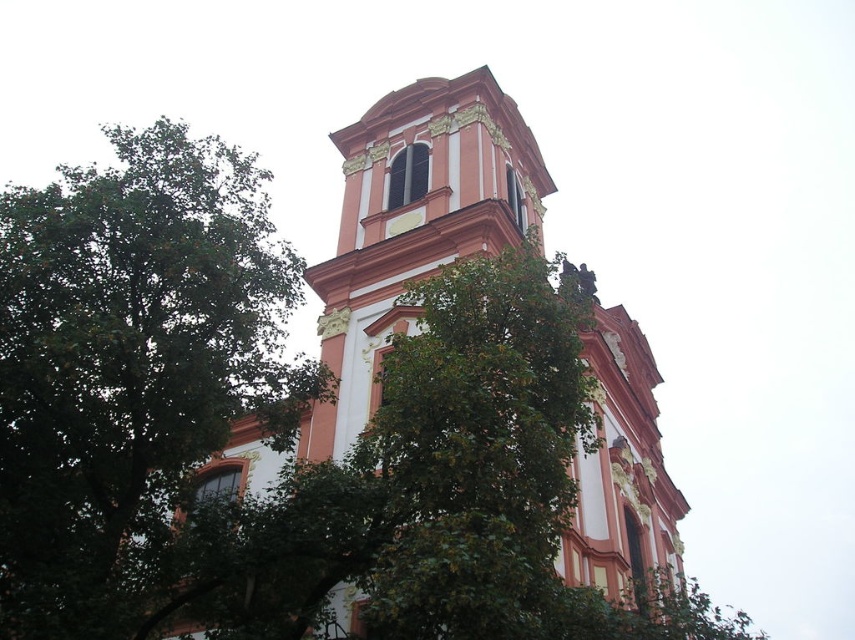
You are an architect visiting the site of the matte orange church at center and the green leafy tree at center. You need to determine if a new sculpture that is 10 meters wide can be placed between them. Can you confirm if there is enough space?

The green leafy tree at center is wider than the matte orange church at center. However, the exact widths are not provided, so it is impossible to determine if the 10 meter wide sculpture can fit between them without additional measurements.

You are standing in front of the church and see a point marked at coordinates [130,368]. Based on the scene description, can you identify what object this point is located on?

The point at coordinates [130,368] is located on the green leafy tree at center.